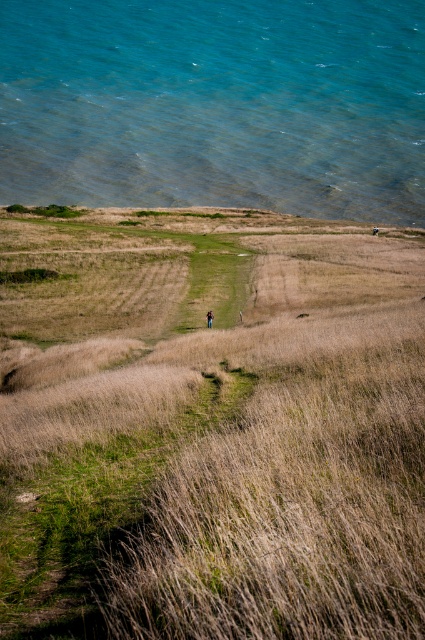
Question: Which object is farther from the camera taking this photo?

Choices:
 (A) brown leather backpack at center
 (B) dry grass at center
 (C) clear blue water at upper left

Answer: (C)

Question: Considering the real-world distances, which object is farthest from the clear blue water at upper left?

Choices:
 (A) brown leather backpack at center
 (B) dry grass at center

Answer: (A)

Question: From the image, what is the correct spatial relationship of dry grass at center in relation to clear blue water at upper left?

Choices:
 (A) left
 (B) right

Answer: (A)

Question: Which point is closer to the camera?

Choices:
 (A) clear blue water at upper left
 (B) dry grass at center
 (C) brown leather backpack at center

Answer: (B)

Question: Does clear blue water at upper left have a lesser width compared to brown leather backpack at center?

Choices:
 (A) no
 (B) yes

Answer: (A)

Question: From the image, what is the correct spatial relationship of dry grass at center in relation to brown leather backpack at center?

Choices:
 (A) below
 (B) above

Answer: (B)